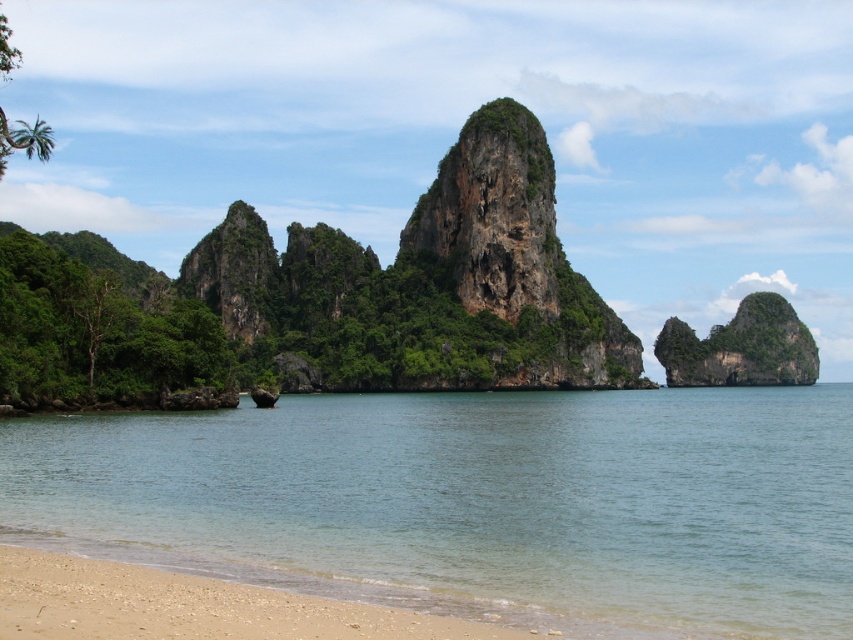
You are a beachcomber searching for seashells. You notice clear water at lower left and light brown gravel at lower left. Which area is higher up on the beach?

The light brown gravel at lower left is higher up on the beach because the clear water at lower left is taller than it, meaning the gravel is situated above the water level.

Consider the image. You are standing on the beach and see two points marked on the image. The first point is at coordinate point (277,436) and the second is at point (148,618). Which point is closer to you?

Point (148,618) is closer to you because it is in front of point (277,436) according to their positions.